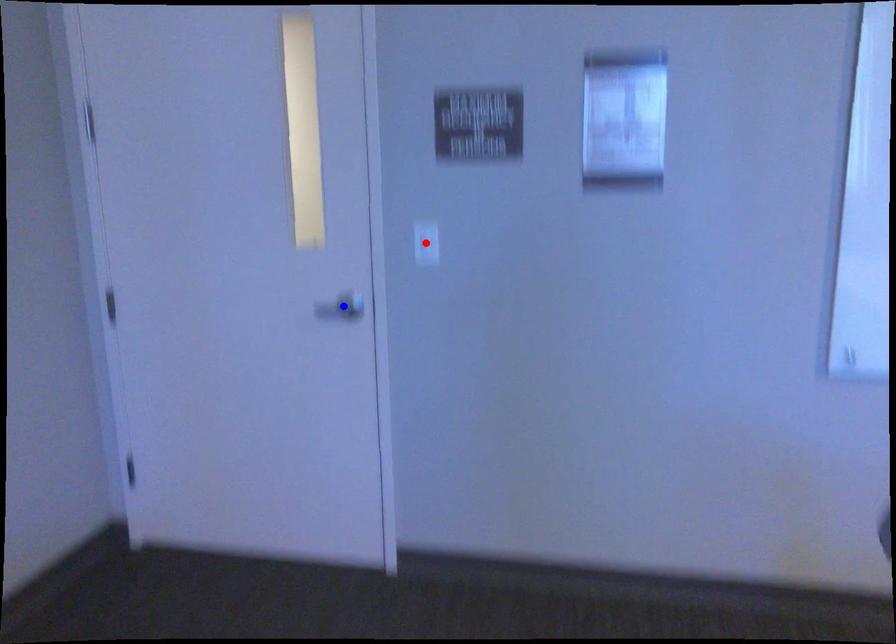
Question: Two points are marked on the image. Which point is closer to the camera?

Choices:
 (A) Blue point is closer.
 (B) Red point is closer.

Answer: (B)